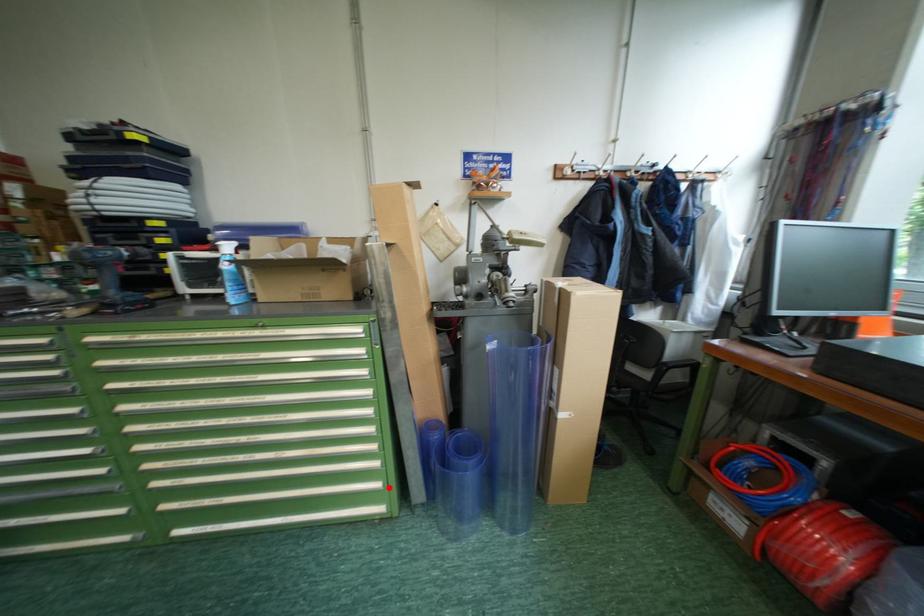
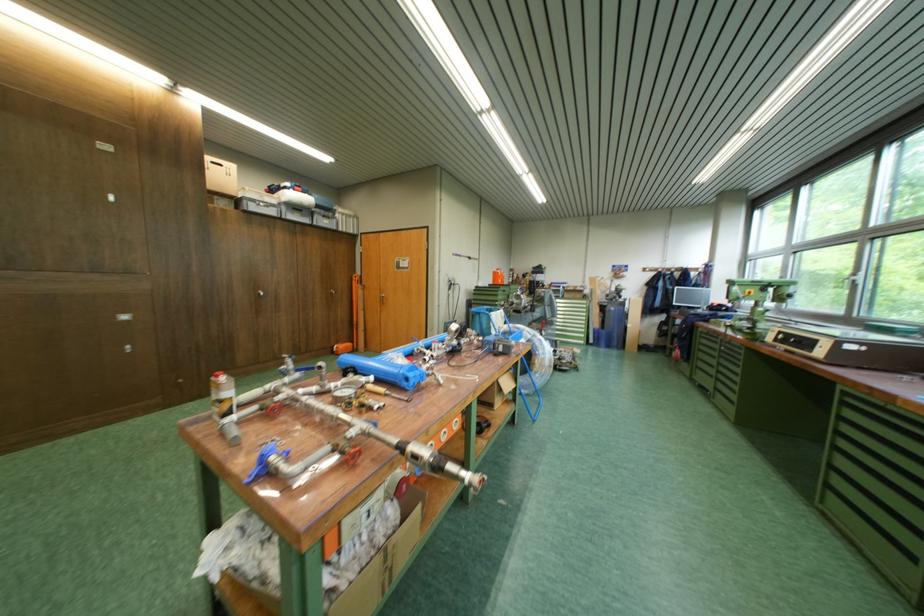
Find the pixel in the second image that matches the highlighted location in the first image.

(592, 338)